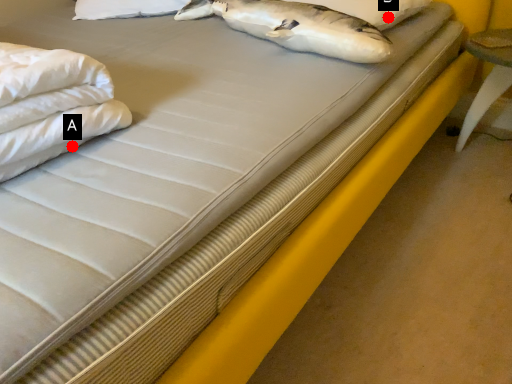
Question: Two points are circled on the image, labeled by A and B beside each circle. Among these points, which one is nearest to the camera?

Choices:
 (A) A is closer
 (B) B is closer

Answer: (A)